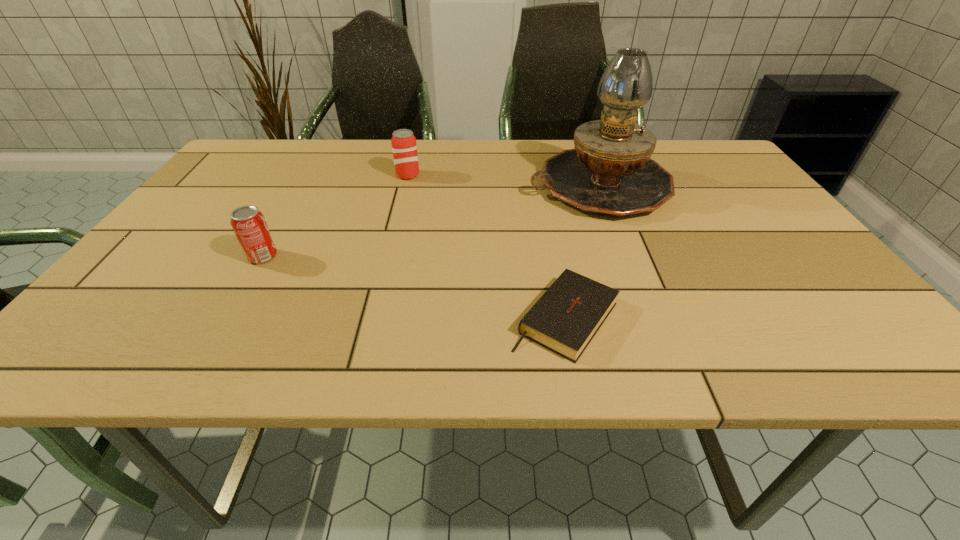
Image resolution: width=960 pixels, height=540 pixels. I want to click on free space between the beer can and the tallest object, so click(x=503, y=181).

Identify the location of free space between the shortest object and the tallest object. This screenshot has width=960, height=540. (582, 252).

I want to click on free space that is in between the third farthest object and the beer can, so [335, 216].

Where is `free space between the Bible and the beer can`? free space between the Bible and the beer can is located at coordinates (487, 247).

I want to click on free space between the second nearest object and the beer can, so click(335, 216).

You are a GUI agent. You are given a task and a screenshot of the screen. Output one action in this format:
    pyautogui.click(x=<x>, y=<y>)
    Task: Click on the empty space between the soda can and the second object from left to right
    The image size is (960, 540).
    Given the screenshot: What is the action you would take?
    pyautogui.click(x=335, y=216)

Identify the location of free area in between the tallest object and the beer can. (503, 181).

Locate an element on the screen. Image resolution: width=960 pixels, height=540 pixels. vacant space that's between the oil lamp and the nearest object is located at coordinates (582, 252).

Where is `object that is the closest to the second nearest object`? The width and height of the screenshot is (960, 540). object that is the closest to the second nearest object is located at coordinates (404, 147).

The height and width of the screenshot is (540, 960). Identify the location of the third closest object to the nearest object. (249, 225).